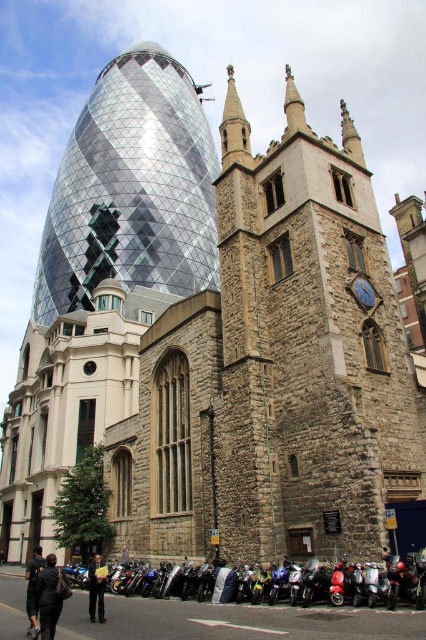
You are a photographer standing in the city square between the modern glass building and the historic stone church. You notice two points marked in the scene. The first point is at coordinates point (37, 584) and the second point is at point (103, 621). Which of these two points is nearer to your camera lens?

Point (37, 584) is closer to the camera than point (103, 621).

You are a photographer standing in the city square between the modern glass building on the left and the historic stone church on the right. You notice an object labeled as point (97,588) in the image. What is the object located at this coordinate?

The point (97,588) marks dark blue jeans at lower left.

You are a fashion designer observing a cityscape with a modern glass building on the left and an old stone church on the right. You notice two items at the lower left corner of the image. Which item is smaller between the dark gray suit at lower left and the dark blue jeans at lower left?

The dark gray suit at lower left is smaller than the dark blue jeans at lower left according to the description.